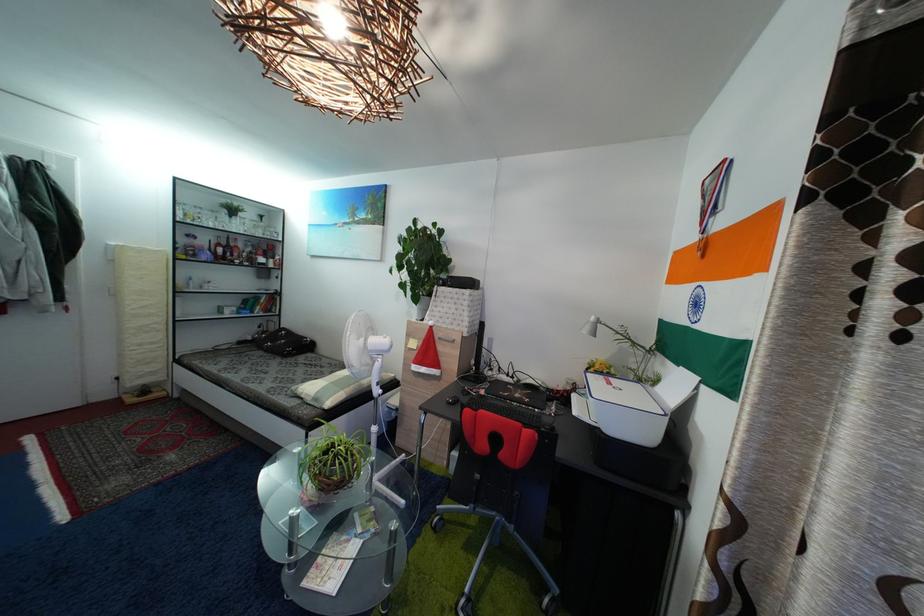
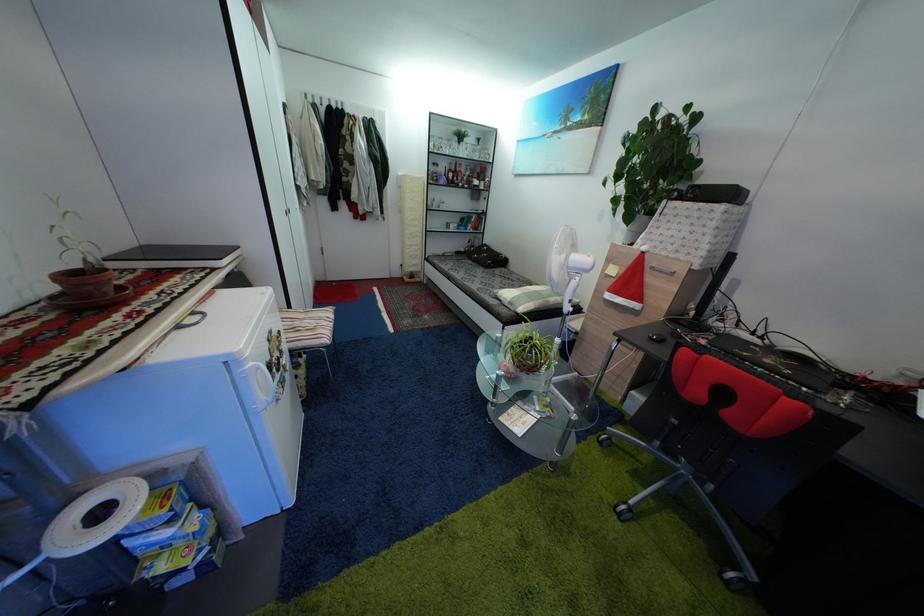
Locate, in the second image, the point that corresponds to (x=445, y=342) in the first image.

(659, 270)